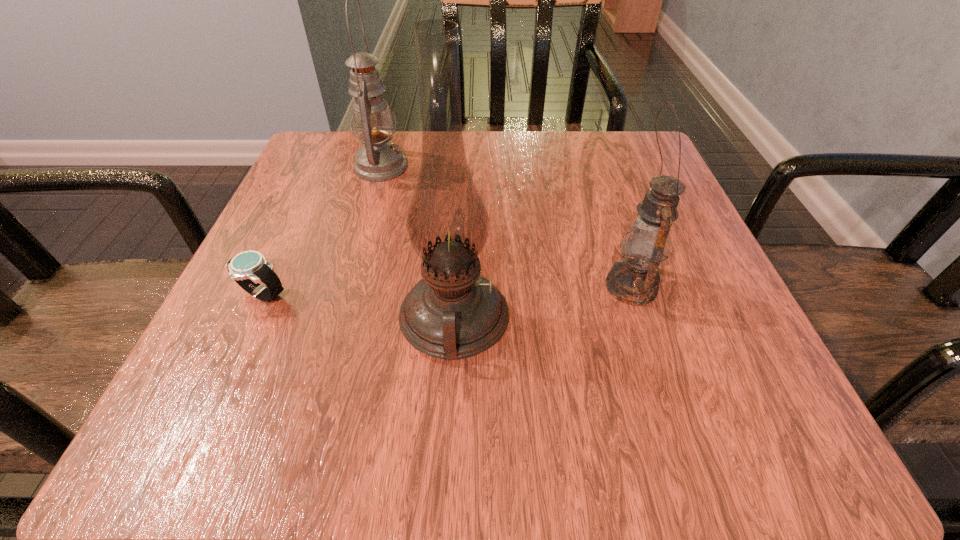
This screenshot has height=540, width=960. I want to click on the second oil lamp from right to left, so click(x=447, y=222).

Where is `the third object from left to right`? The image size is (960, 540). the third object from left to right is located at coordinates (447, 222).

Locate an element on the screen. the leftmost oil lamp is located at coordinates (378, 160).

Where is `the farthest oil lamp`? The image size is (960, 540). the farthest oil lamp is located at coordinates (378, 160).

Locate an element on the screen. the rightmost object is located at coordinates (634, 280).

The height and width of the screenshot is (540, 960). What are the coordinates of `the leftmost object` in the screenshot? It's located at (249, 268).

The image size is (960, 540). I want to click on the shortest object, so click(x=249, y=268).

Image resolution: width=960 pixels, height=540 pixels. I want to click on vacant space located on the back of the third object from left to right, so click(x=458, y=237).

Where is `vacant region located on the right of the leftmost oil lamp`? The width and height of the screenshot is (960, 540). vacant region located on the right of the leftmost oil lamp is located at coordinates (492, 167).

Locate an element on the screen. vacant space located 0.170m on the left of the rightmost oil lamp is located at coordinates (493, 286).